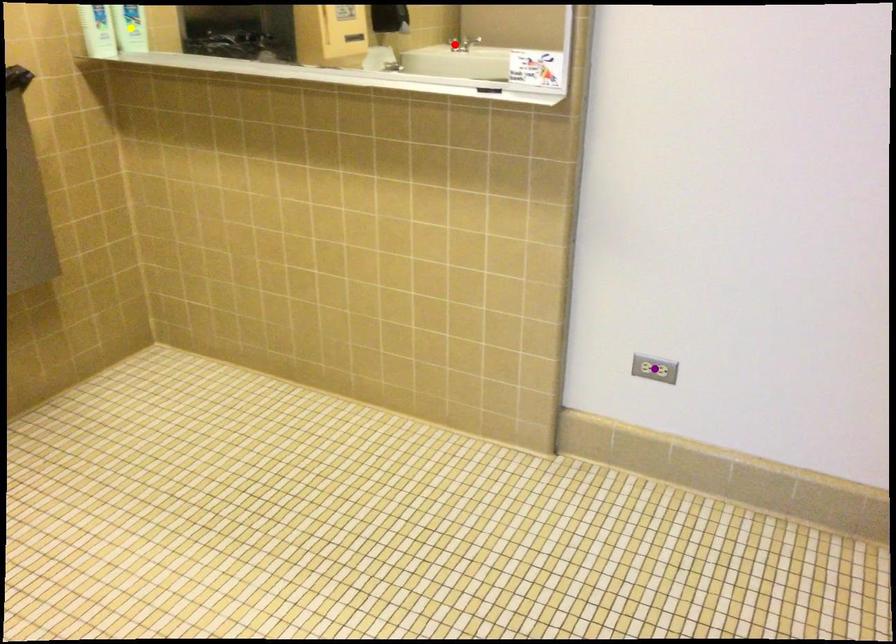
Order these from farthest to nearest:
red point, purple point, yellow point

red point → yellow point → purple point